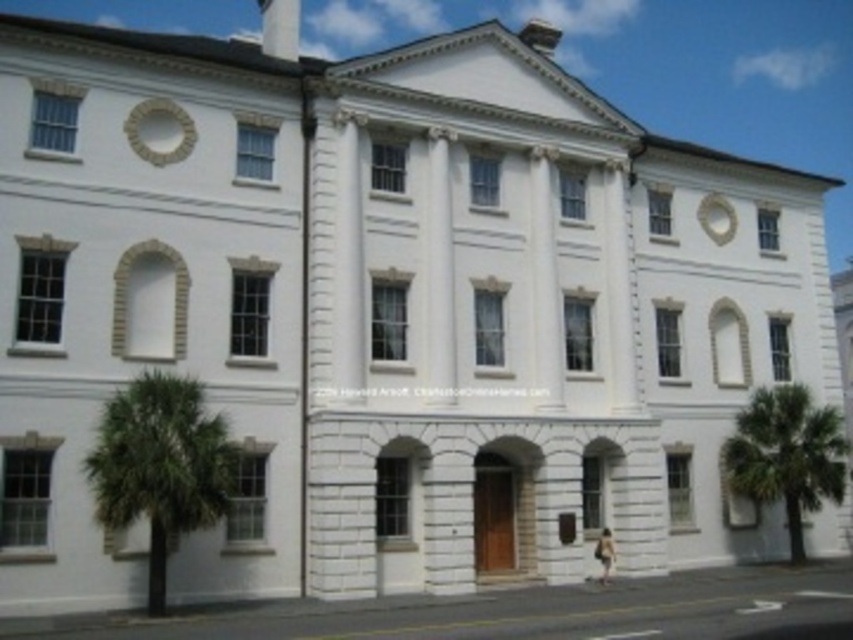
Question: Which object appears closest to the camera in this image?

Choices:
 (A) green leafy palm tree at lower left
 (B) green leafy palm tree at right

Answer: (A)

Question: Which point is farther to the camera?

Choices:
 (A) green leafy palm tree at lower left
 (B) green leafy palm tree at right

Answer: (B)

Question: Can you confirm if green leafy palm tree at lower left is positioned to the left of green leafy palm tree at right?

Choices:
 (A) no
 (B) yes

Answer: (B)

Question: Does green leafy palm tree at lower left appear under green leafy palm tree at right?

Choices:
 (A) no
 (B) yes

Answer: (A)

Question: Can you confirm if green leafy palm tree at lower left is positioned below green leafy palm tree at right?

Choices:
 (A) yes
 (B) no

Answer: (B)